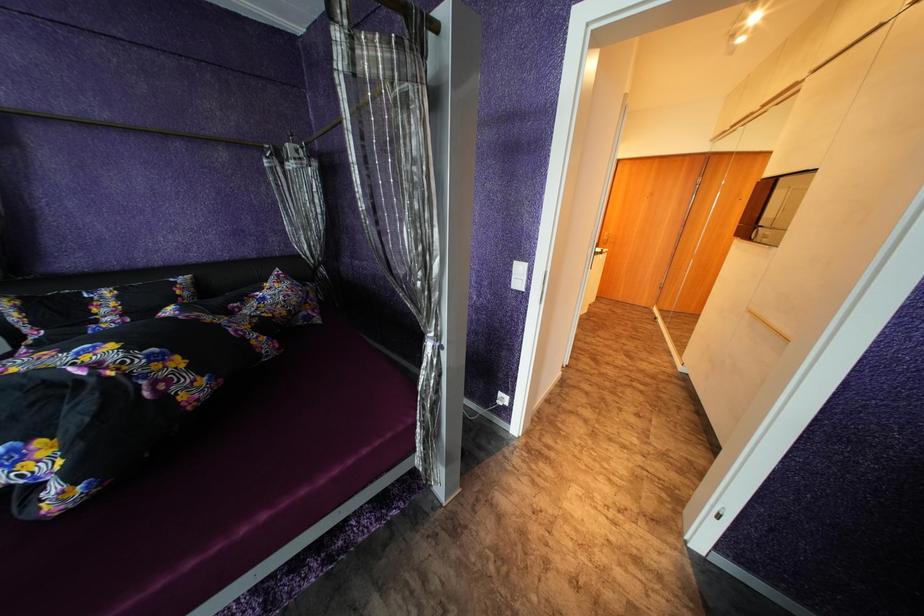
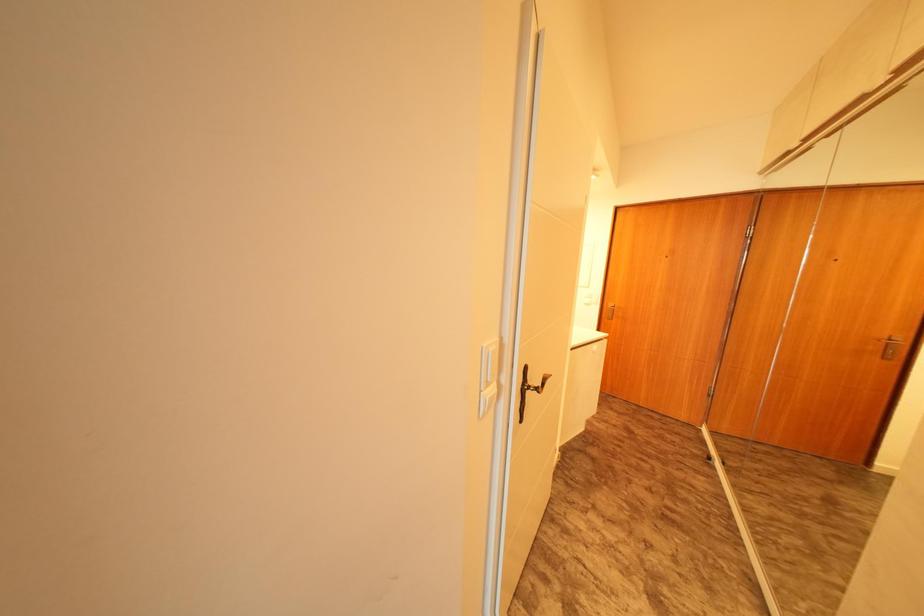
Which direction would the cameraman need to move to produce the second image?

The movement direction of the cameraman is right, forward.